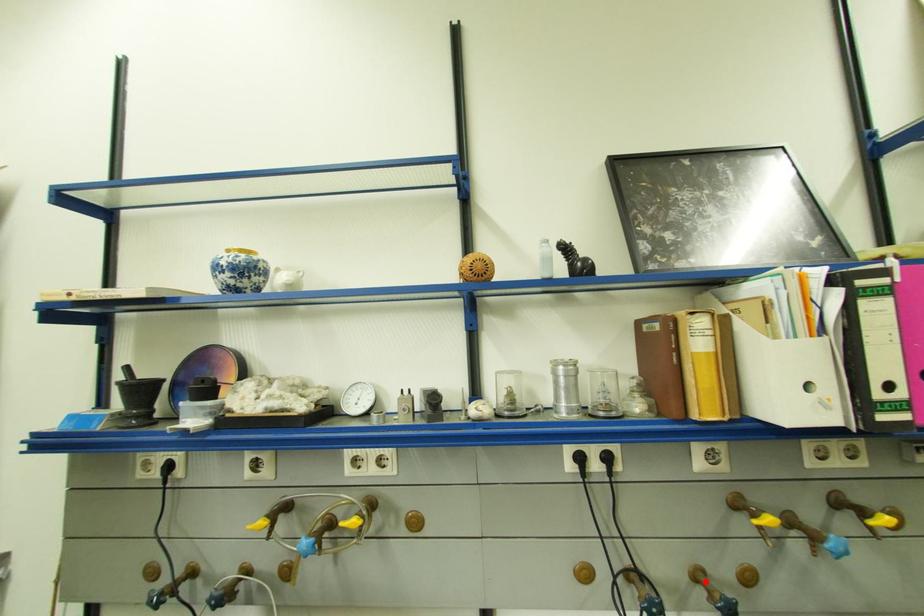
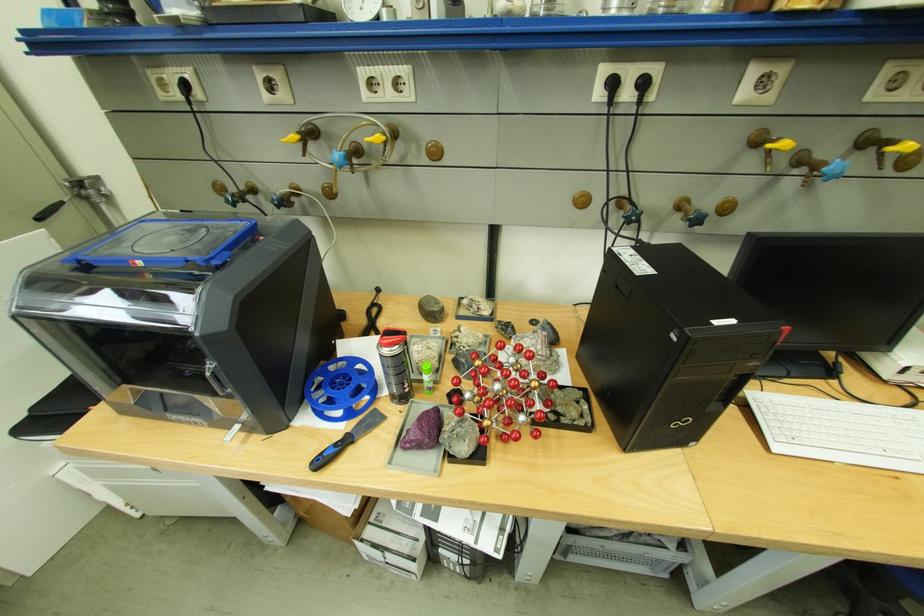
The point at the highlighted location is marked in the first image. Where is the corresponding point in the second image?

(688, 208)